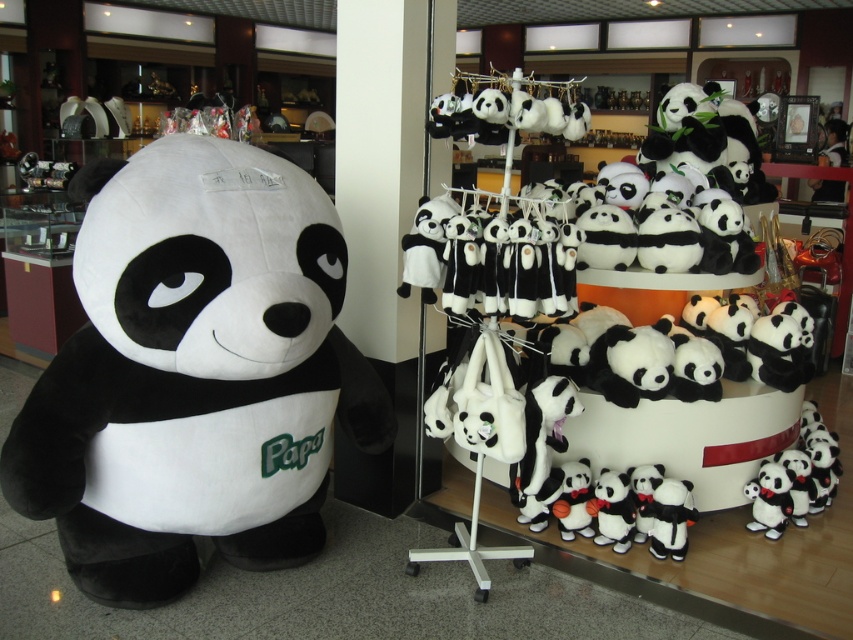
Question: Which object appears farthest from the camera in this image?

Choices:
 (A) soft plush panda at lower right
 (B) soft plush panda at left
 (C) soft plush panda at center

Answer: (A)

Question: Can you confirm if soft plush panda at left is thinner than soft plush panda at center?

Choices:
 (A) yes
 (B) no

Answer: (B)

Question: Is soft plush panda at left above soft plush panda at center?

Choices:
 (A) yes
 (B) no

Answer: (B)

Question: Which object is closer to the camera taking this photo?

Choices:
 (A) soft plush panda at lower right
 (B) soft plush panda at left
 (C) soft plush panda at center

Answer: (B)

Question: Is soft plush panda at left below soft plush panda at center?

Choices:
 (A) yes
 (B) no

Answer: (A)

Question: Considering the real-world distances, which object is closest to the soft plush panda at left?

Choices:
 (A) soft plush panda at lower right
 (B) soft plush panda at center

Answer: (B)